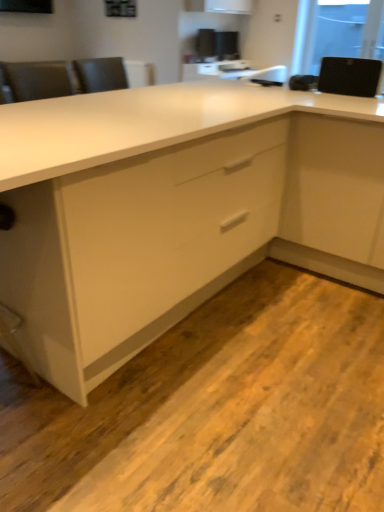
Question: Is black matte speaker at upper right directly adjacent to transparent glass window screen at upper right?

Choices:
 (A) yes
 (B) no

Answer: (B)

Question: Considering the relative sizes of black matte speaker at upper right and transparent glass window screen at upper right in the image provided, is black matte speaker at upper right thinner than transparent glass window screen at upper right?

Choices:
 (A) no
 (B) yes

Answer: (A)

Question: Can you confirm if black matte speaker at upper right is bigger than transparent glass window screen at upper right?

Choices:
 (A) yes
 (B) no

Answer: (B)

Question: Does black matte speaker at upper right have a greater width compared to transparent glass window screen at upper right?

Choices:
 (A) no
 (B) yes

Answer: (B)

Question: Does black matte speaker at upper right come behind transparent glass window screen at upper right?

Choices:
 (A) no
 (B) yes

Answer: (A)

Question: From a real-world perspective, is black matte speaker at upper right located beneath transparent glass window screen at upper right?

Choices:
 (A) yes
 (B) no

Answer: (A)

Question: From the image's perspective, is transparent glass window screen at upper right under black matte speaker at upper right?

Choices:
 (A) yes
 (B) no

Answer: (B)

Question: Is transparent glass window screen at upper right further to camera compared to black matte speaker at upper right?

Choices:
 (A) no
 (B) yes

Answer: (B)

Question: Is transparent glass window screen at upper right taller than black matte speaker at upper right?

Choices:
 (A) no
 (B) yes

Answer: (B)

Question: Can you confirm if transparent glass window screen at upper right is wider than black matte speaker at upper right?

Choices:
 (A) no
 (B) yes

Answer: (A)

Question: Does transparent glass window screen at upper right turn towards black matte speaker at upper right?

Choices:
 (A) yes
 (B) no

Answer: (A)

Question: From a real-world perspective, is transparent glass window screen at upper right below black matte speaker at upper right?

Choices:
 (A) no
 (B) yes

Answer: (A)

Question: Considering the relative sizes of transparent glass window screen at upper right and white glossy cabinet at center in the image provided, is transparent glass window screen at upper right smaller than white glossy cabinet at center?

Choices:
 (A) no
 (B) yes

Answer: (B)